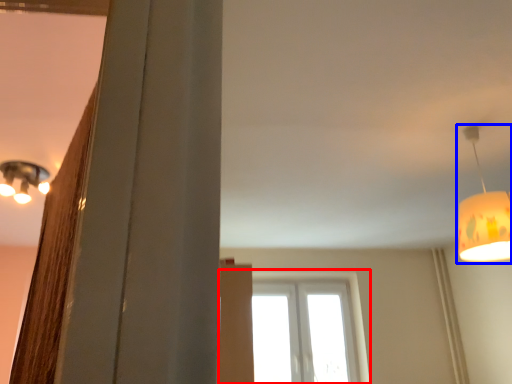
Question: Which object is further to the camera taking this photo, window (highlighted by a red box) or lamp (highlighted by a blue box)?

Choices:
 (A) window
 (B) lamp

Answer: (A)